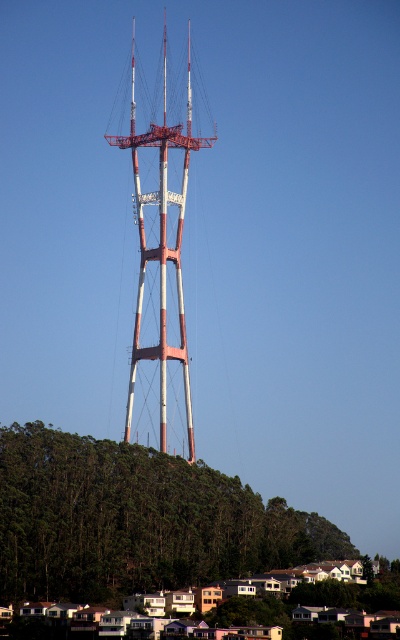
Does green leafy hillside at lower left have a greater width compared to metallic red and white tower at center?

Yes, green leafy hillside at lower left is wider than metallic red and white tower at center.

Between point (192, 477) and point (152, 346), which one is positioned behind?

The point (152, 346) is behind.

Who is more distant from viewer, (218, 500) or (188, 109)?

Positioned behind is point (188, 109).

Find the location of a particular element. green leafy hillside at lower left is located at coordinates (136, 520).